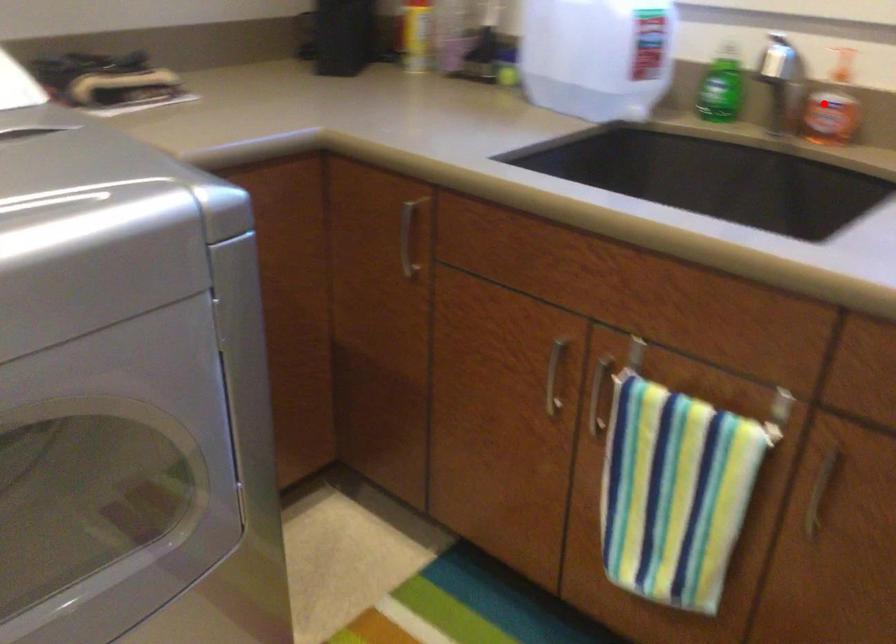
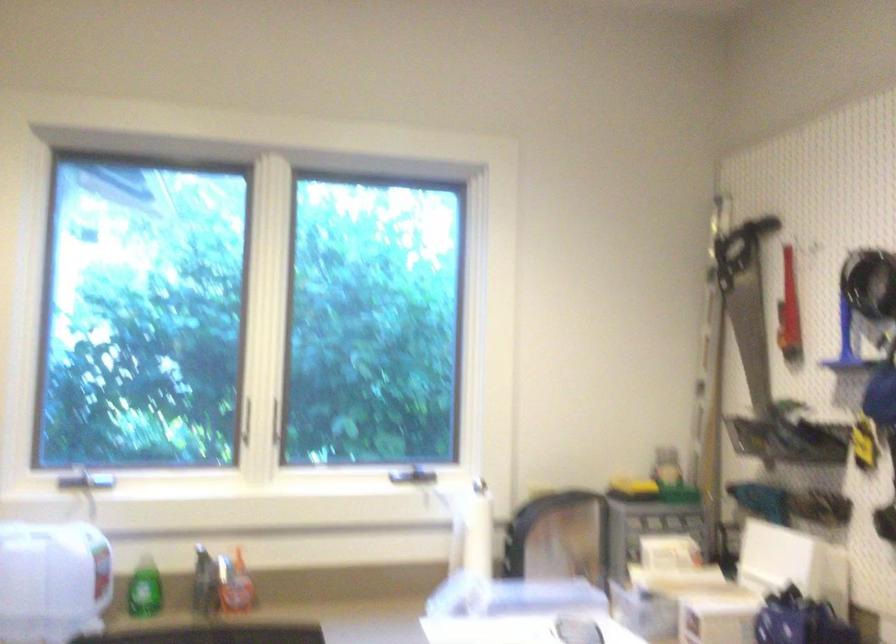
The point at the highlighted location is marked in the first image. Where is the corresponding point in the second image?

(234, 583)